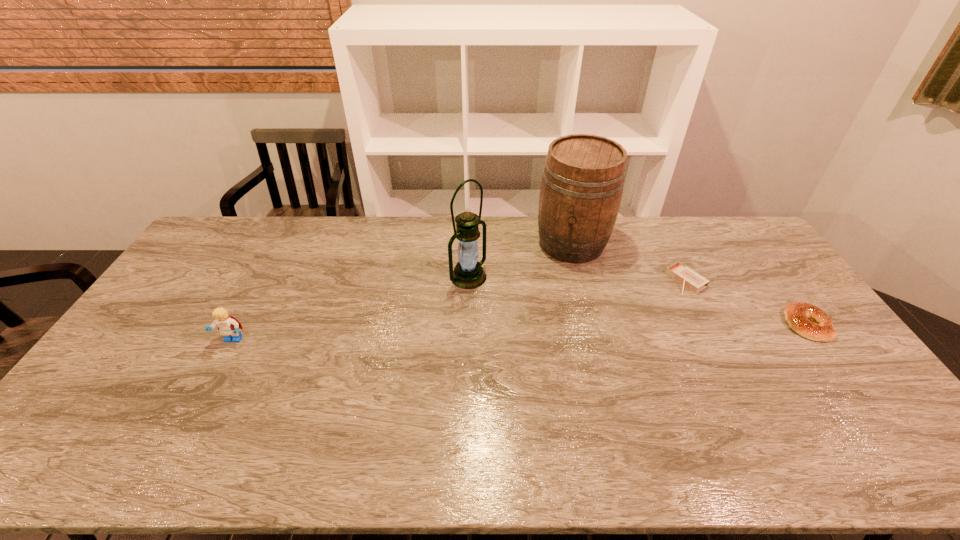
This screenshot has height=540, width=960. I want to click on free space located 0.340m on the side where the lantern emits light, so click(x=564, y=342).

What are the coordinates of `vacant space located on the side of the cider near the bung hole` in the screenshot? It's located at [x=551, y=310].

Where is `free space located 0.150m on the side of the cider near the bung hole`? This screenshot has height=540, width=960. free space located 0.150m on the side of the cider near the bung hole is located at coordinates (556, 295).

This screenshot has height=540, width=960. Find the location of `free region located 0.340m on the side of the cider near the bung hole`. free region located 0.340m on the side of the cider near the bung hole is located at coordinates (542, 338).

What are the coordinates of `free location located 0.210m on the striking surface of the matchbox` in the screenshot? It's located at (631, 314).

What are the coordinates of `vacant space located on the striking surface of the matchbox` in the screenshot? It's located at (603, 331).

Identify the location of free space located on the striking surface of the matchbox. This screenshot has height=540, width=960. (657, 299).

Where is `object present at the far edge`? object present at the far edge is located at coordinates (583, 178).

The height and width of the screenshot is (540, 960). What are the coordinates of `object located at the right edge` in the screenshot? It's located at point(809,321).

In order to click on vacant position at the far edge of the desktop in this screenshot , I will do pyautogui.click(x=277, y=228).